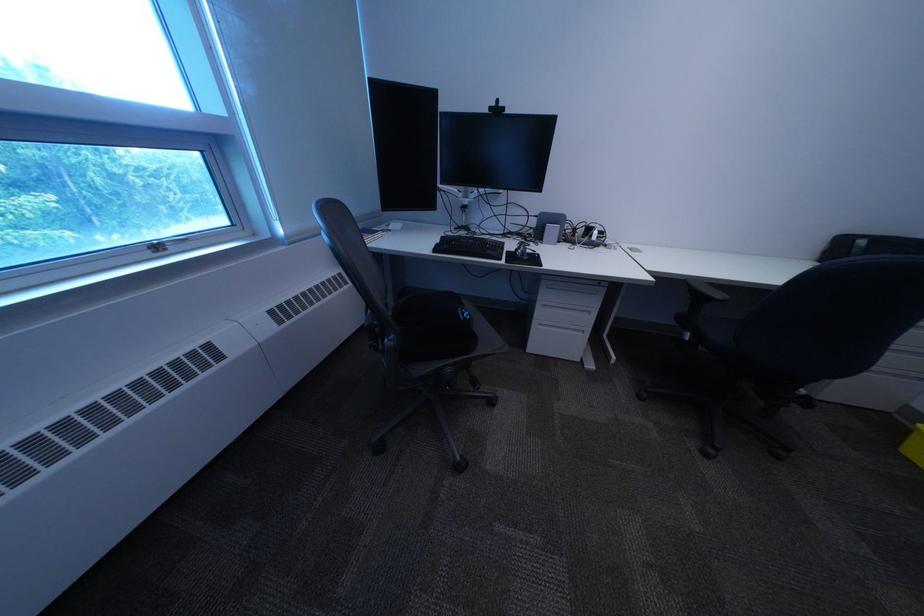
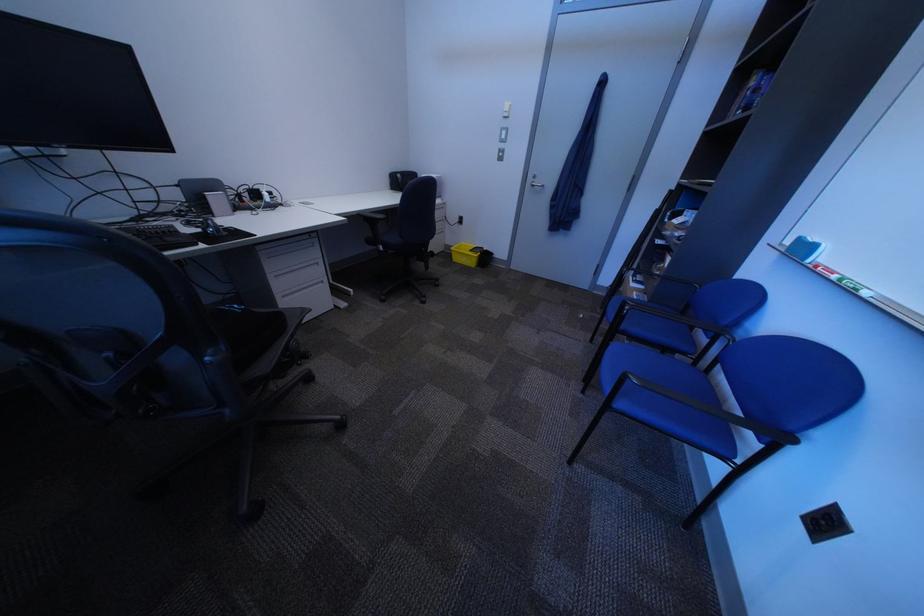
Find the pixel in the second image that matches [529,252] in the first image.

(214, 232)